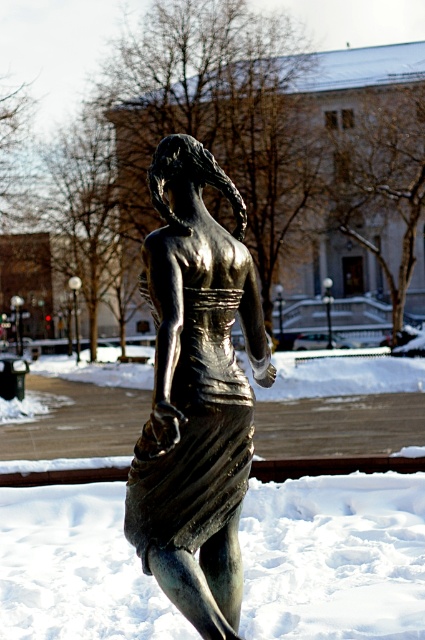
You are an art student analyzing the statue in the snowy scene. You notice the shiny bronze statue at center and the shiny bronze dress at center. Which object is placed higher in the image?

The shiny bronze statue at center is positioned over the shiny bronze dress at center, so the statue is higher than the dress.

You are an artist planning to sketch the scene. You notice the white frosty snow at lower center and the shiny bronze statue at center. Which object is taller in the image?

The shiny bronze statue at center is taller than the white frosty snow at lower center.